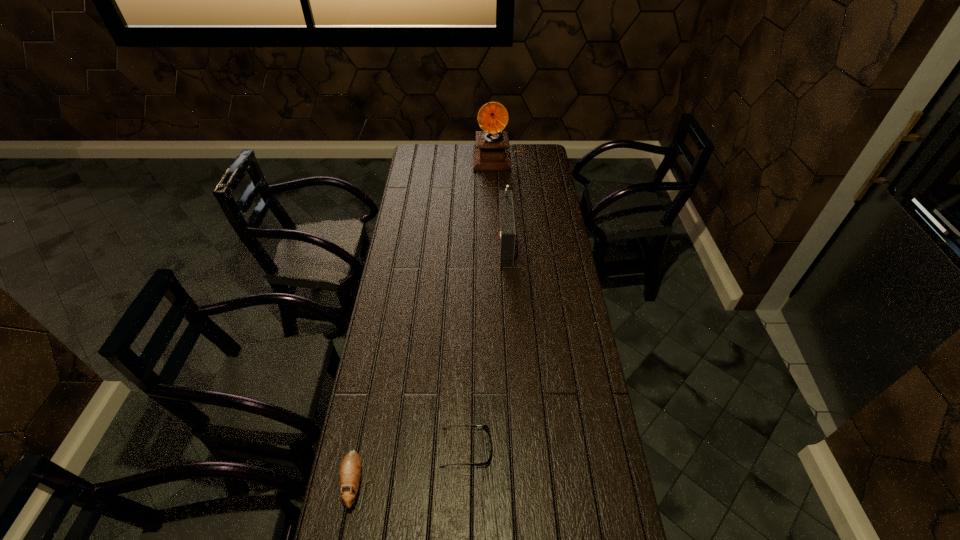
Identify the location of empty space between the third tallest object and the shortest object. (410, 465).

Identify which object is the nearest to the second shortest object. Please provide its 2D coordinates. Your answer should be formatted as a tuple, i.e. [(x, y)], where the tuple contains the x and y coordinates of a point satisfying the conditions above.

[(485, 427)]

Select which object is the closest to the third shortest object. Please provide its 2D coordinates. Your answer should be formatted as a tuple, i.e. [(x, y)], where the tuple contains the x and y coordinates of a point satisfying the conditions above.

[(492, 153)]

Locate an element on the screen. The width and height of the screenshot is (960, 540). free location that satisfies the following two spatial constraints: 1. on the front panel of the second tallest object; 2. at the face of the leftmost object is located at coordinates (517, 482).

Find the location of `vacant region that satisfies the following two spatial constraints: 1. on the front-facing side of the sunglasses; 2. at the face of the leftmost object`. vacant region that satisfies the following two spatial constraints: 1. on the front-facing side of the sunglasses; 2. at the face of the leftmost object is located at coordinates (466, 482).

Where is `free space that satisfies the following two spatial constraints: 1. on the front panel of the third nearest object; 2. at the face of the hamster`? free space that satisfies the following two spatial constraints: 1. on the front panel of the third nearest object; 2. at the face of the hamster is located at coordinates (517, 482).

The width and height of the screenshot is (960, 540). I want to click on blank area in the image that satisfies the following two spatial constraints: 1. on the front panel of the second tallest object; 2. at the face of the second shortest object, so click(517, 482).